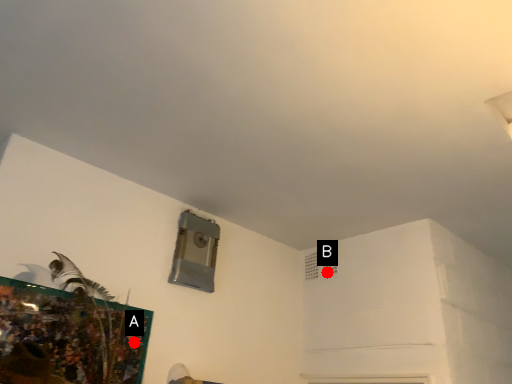
Question: Two points are circled on the image, labeled by A and B beside each circle. Which of the following is the farthest from the observer?

Choices:
 (A) A is further
 (B) B is further

Answer: (B)